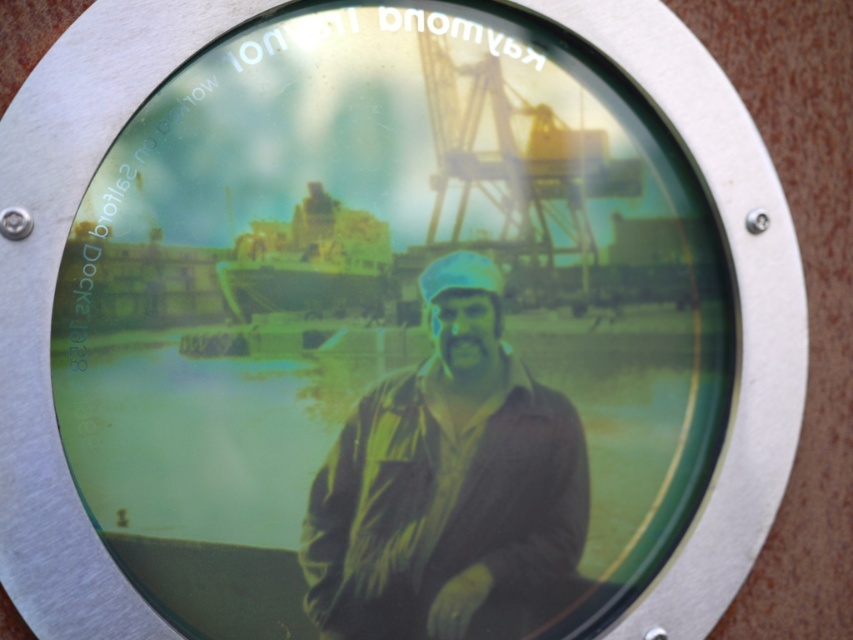
What is the color of the jacket at the point specified by the coordinates (448,484)?

The point at coordinates (448,484) is on the matte black jacket at center, so the color is matte black.